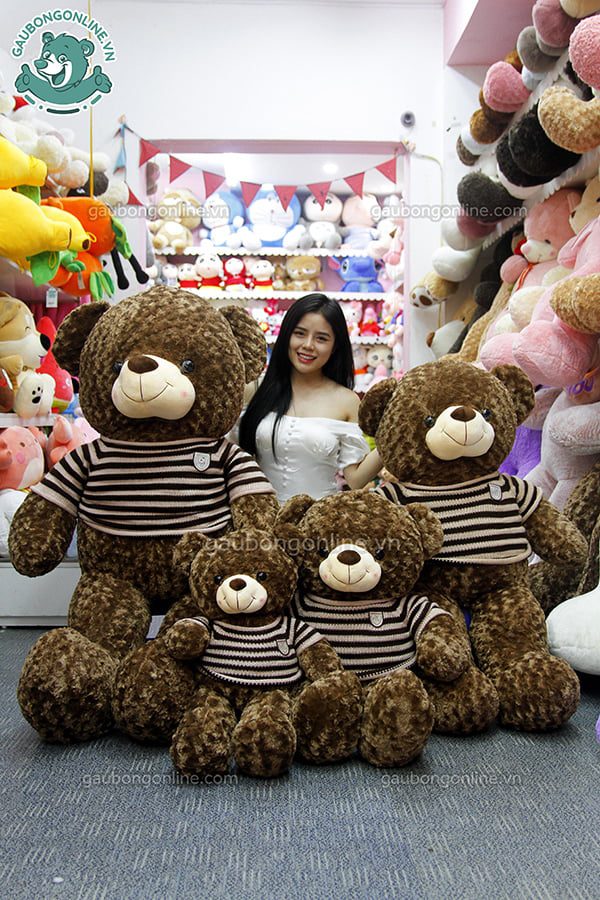
This screenshot has height=900, width=600. Find the location of `security camera`. security camera is located at coordinates click(x=402, y=124), click(x=414, y=124), click(x=410, y=106).